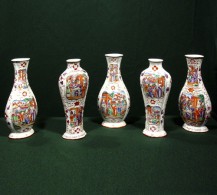
Identify the location of green tabletop. This screenshot has height=195, width=217. (120, 157).